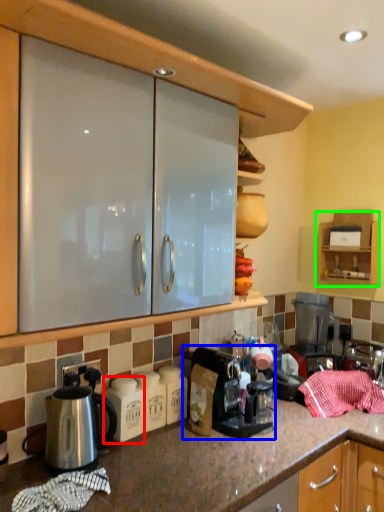
Question: Which object is the closest to the appliance (highlighted by a red box)? Choose among these: coffee maker (highlighted by a blue box) or cabinetry (highlighted by a green box).

Choices:
 (A) coffee maker
 (B) cabinetry

Answer: (A)